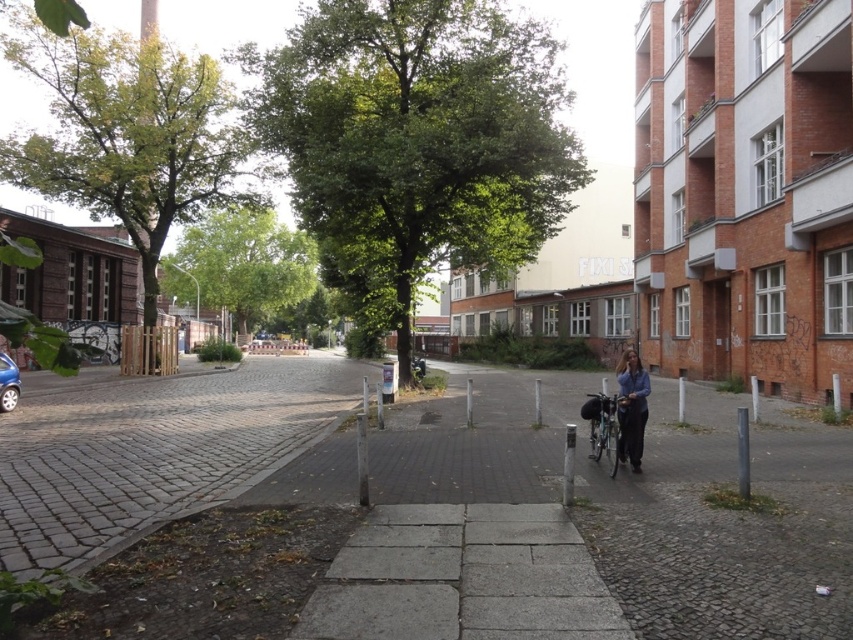
Question: Which object appears closest to the camera in this image?

Choices:
 (A) shiny metallic bicycle at center
 (B) blue denim jacket at lower right

Answer: (A)

Question: Considering the real-world distances, which object is farthest from the shiny metallic bicycle at center?

Choices:
 (A) blue denim jacket at lower right
 (B) gray concrete pavement at center

Answer: (B)

Question: Is gray concrete pavement at center to the left of shiny metallic bicycle at center from the viewer's perspective?

Choices:
 (A) no
 (B) yes

Answer: (B)

Question: From the image, what is the correct spatial relationship of gray concrete pavement at center in relation to shiny metallic bicycle at center?

Choices:
 (A) above
 (B) below

Answer: (B)

Question: Is blue denim jacket at lower right wider than shiny metallic bicycle at center?

Choices:
 (A) no
 (B) yes

Answer: (A)

Question: Which object is the farthest from the shiny metallic bicycle at center?

Choices:
 (A) gray concrete pavement at center
 (B) blue denim jacket at lower right

Answer: (A)